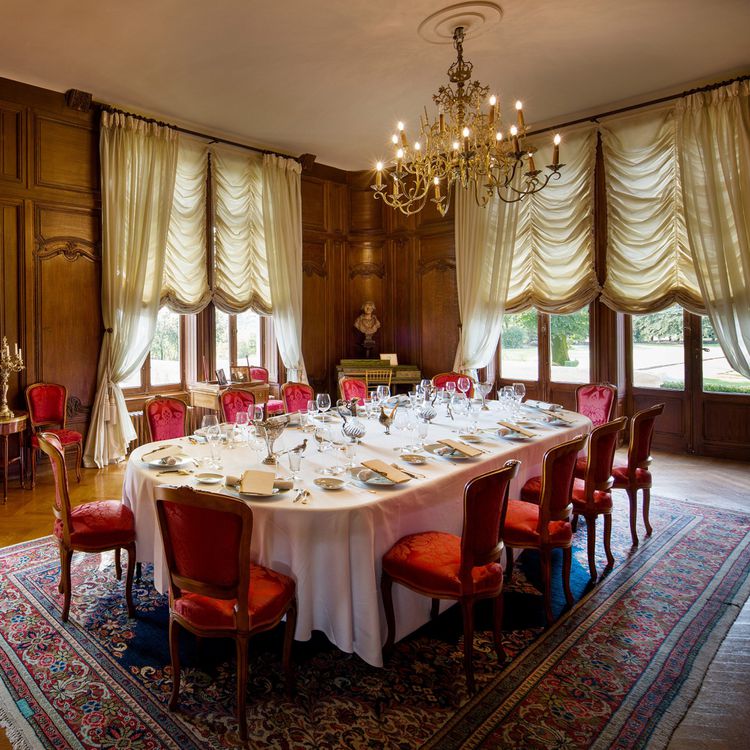
Identify the location of chandelier. Image resolution: width=750 pixels, height=750 pixels. (429, 169).